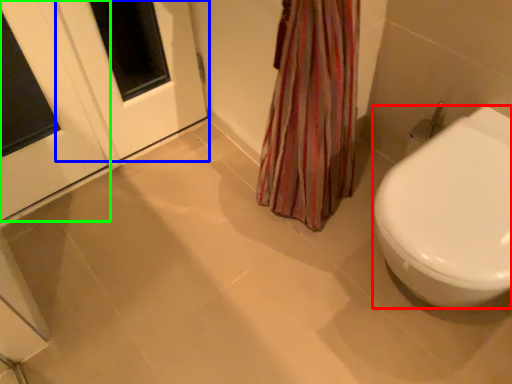
Question: Considering the real-world distances, which object is farthest from bidet (highlighted by a red box)? screen door (highlighted by a blue box) or door (highlighted by a green box)?

Choices:
 (A) screen door
 (B) door

Answer: (B)